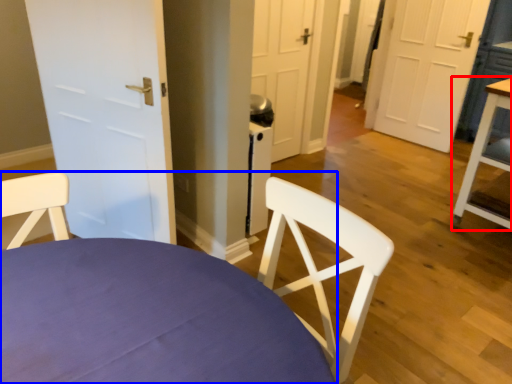
Question: Which of the following is the closest to the observer, table (highlighted by a red box) or chair (highlighted by a blue box)?

Choices:
 (A) table
 (B) chair

Answer: (B)